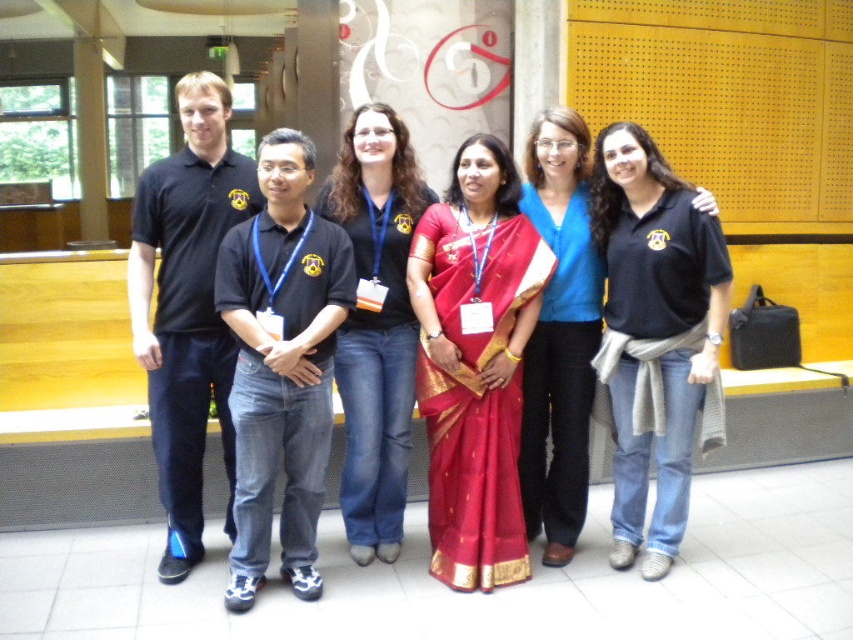
Is black cotton polo shirt at left thinner than black cotton shirt at center?

Incorrect, black cotton polo shirt at left's width is not less than black cotton shirt at center's.

Who is positioned more to the right, black cotton polo shirt at left or black cotton shirt at center?

black cotton shirt at center is more to the right.

Between point (192, 168) and point (367, 227), which one is positioned behind?

Positioned behind is point (367, 227).

Locate an element on the screen. black cotton polo shirt at left is located at coordinates (187, 307).

Is silky red sari at center bigger than black cotton shirt at center?

Yes.

Which is more to the left, silky red sari at center or black cotton shirt at center?

black cotton shirt at center is more to the left.

I want to click on silky red sari at center, so click(x=474, y=364).

This screenshot has width=853, height=640. I want to click on silky red sari at center, so click(474, 364).

Does silky red sari at center have a larger size compared to black cotton polo shirt at left?

No.

Who is more forward, (463, 401) or (184, 292)?

Point (184, 292) is in front.

Does point (532, 262) come farther from viewer compared to point (200, 401)?

Yes.

Locate an element on the screen. silky red sari at center is located at coordinates (474, 364).